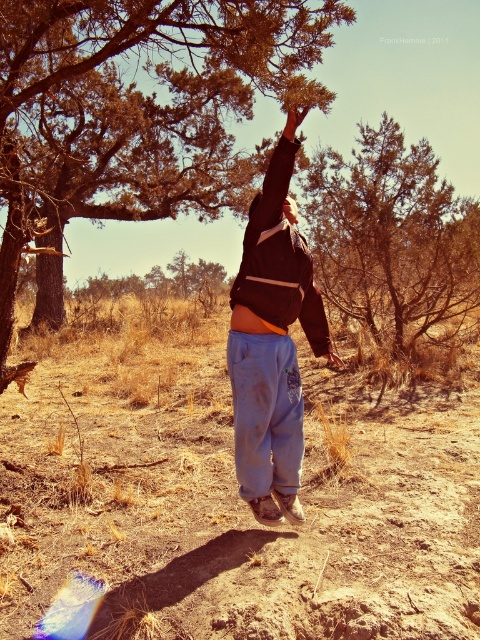
Question: Does dried grass at center appear on the left side of smooth skin hand at upper center?

Choices:
 (A) yes
 (B) no

Answer: (A)

Question: Based on their relative distances, which object is farther from the smooth skin hand at upper center?

Choices:
 (A) black matte arm at upper center
 (B) brown textured tree at upper center
 (C) blue cotton pants at center

Answer: (B)

Question: Among these objects, which one is nearest to the camera?

Choices:
 (A) dried grass at center
 (B) brown textured tree at upper center
 (C) black matte arm at upper center

Answer: (A)

Question: Does brown textured tree at upper center have a larger size compared to black matte arm at upper center?

Choices:
 (A) yes
 (B) no

Answer: (B)

Question: Which point is farther to the camera?

Choices:
 (A) pos(330,364)
 (B) pos(394,122)
 (C) pos(407,576)
 (D) pos(242,332)

Answer: (B)

Question: Does dried grass at center appear on the left side of black matte arm at upper center?

Choices:
 (A) yes
 (B) no

Answer: (A)